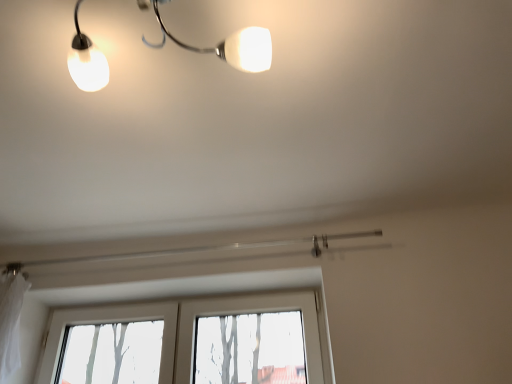
Identify the location of matte white light fixture at upper left. (226, 44).

Describe the element at coordinates (226, 44) in the screenshot. Image resolution: width=512 pixels, height=384 pixels. I see `matte white light fixture at upper left` at that location.

Find the location of a particular element. matte white light fixture at upper left is located at coordinates (226, 44).